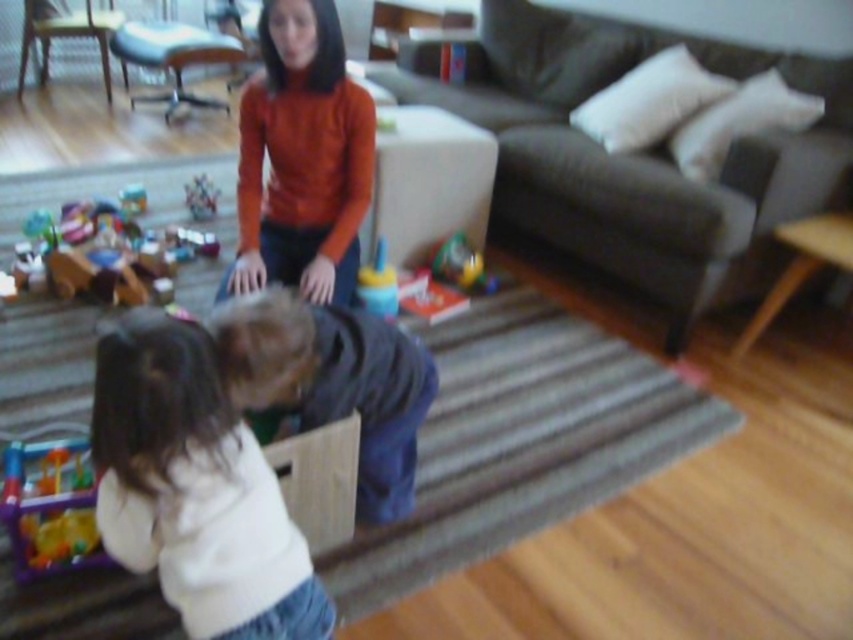
Question: Among these objects, which one is nearest to the camera?

Choices:
 (A) orange matte sweater at upper center
 (B) wooden toy car at lower left
 (C) translucent plastic toy at lower left
 (D) plastic toy at center

Answer: (C)

Question: Is the position of plastic colorful toy at center less distant than that of matte plastic toy at center?

Choices:
 (A) yes
 (B) no

Answer: (B)

Question: Which of the following is the closest to the observer?

Choices:
 (A) translucent plastic toy at lower left
 (B) plastic toy at center
 (C) wooden toy car at lower left
 (D) dark gray fabric couch at upper right

Answer: (A)

Question: Observing the image, what is the correct spatial positioning of dark blue fabric at center in reference to wooden toy car at lower left?

Choices:
 (A) left
 (B) right

Answer: (B)

Question: Which object is the farthest from the plastic toy at center?

Choices:
 (A) orange matte sweater at upper center
 (B) dark blue fabric at center
 (C) translucent plastic toy at lower left

Answer: (B)

Question: Is translucent plastic toy at lower left behind matte plastic toy at center?

Choices:
 (A) yes
 (B) no

Answer: (B)